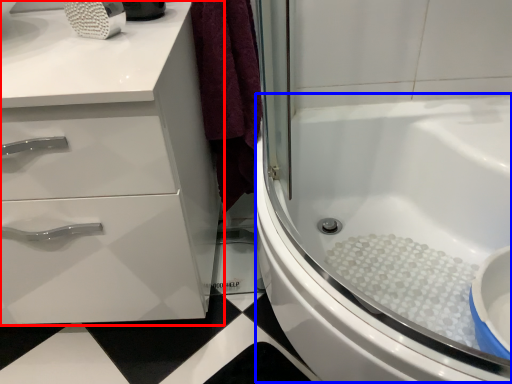
Question: Which point is closer to the camera, bathroom cabinet (highlighted by a red box) or bath (highlighted by a blue box)?

Choices:
 (A) bathroom cabinet
 (B) bath

Answer: (B)